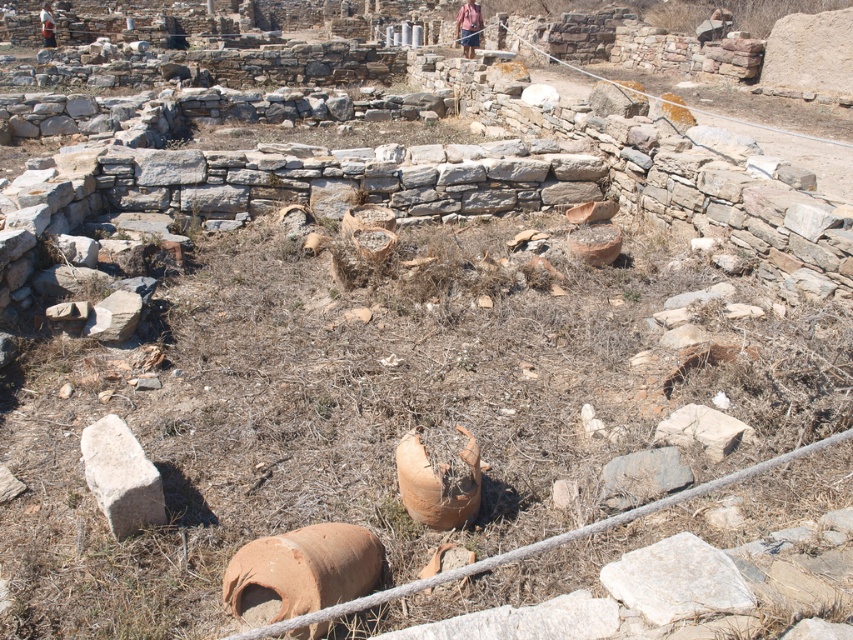
You are an archaeologist examining the site. You notice the white rough stone at center and the camouflage fabric shirt at upper left. Which object is positioned lower in the scene?

The white rough stone at center is located below camouflage fabric shirt at upper left, so it is positioned lower in the scene.

You are an archaeologist standing at the edge of the archaeological site. You notice the white rough stone at center. Can you estimate its 2D coordinates in the image?

The white rough stone at center is located at the 2D coordinates of point (x=677, y=579).